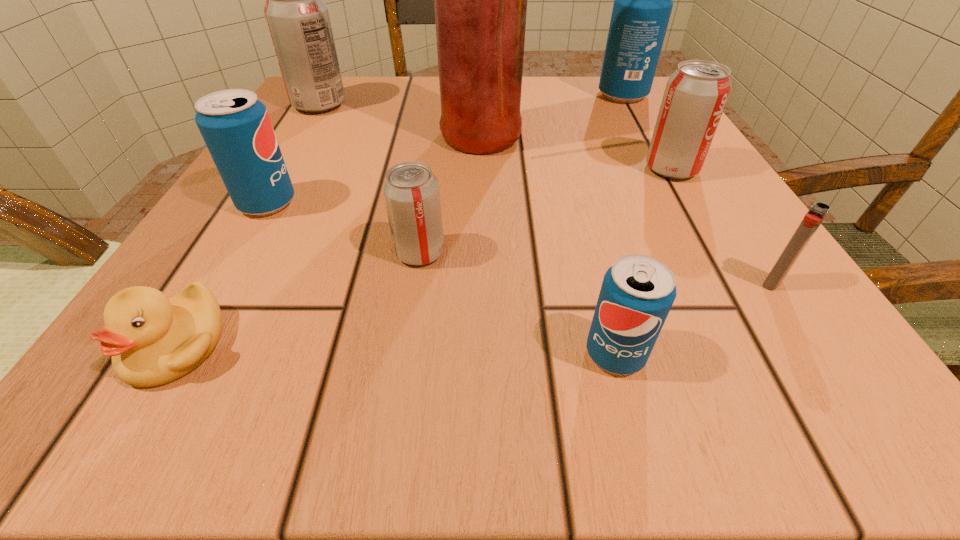
Identify the location of object situated at the far left corner. (298, 20).

Where is `object that is positioned at the near left corner`? Image resolution: width=960 pixels, height=540 pixels. object that is positioned at the near left corner is located at coordinates (153, 340).

Where is `object that is at the far right corner`? object that is at the far right corner is located at coordinates (643, 0).

This screenshot has height=540, width=960. I want to click on free region at the far edge of the desktop, so click(559, 80).

The width and height of the screenshot is (960, 540). In the image, there is a desktop. In order to click on free space at the near edge in this screenshot , I will do `click(660, 397)`.

This screenshot has width=960, height=540. In the image, there is a desktop. In order to click on vacant region at the left edge in this screenshot , I will do `click(346, 166)`.

Where is `vacant area at the right edge of the desktop`? The height and width of the screenshot is (540, 960). vacant area at the right edge of the desktop is located at coordinates (717, 257).

Locate an element on the screen. This screenshot has width=960, height=540. free region at the far left corner of the desktop is located at coordinates (293, 122).

You are a GUI agent. You are given a task and a screenshot of the screen. Output one action in this format:
    pyautogui.click(x=<x>, y=<y>)
    Task: Click on the vacant area at the far right corner
    The image size is (960, 540).
    Given the screenshot: What is the action you would take?
    pyautogui.click(x=581, y=87)

In the image, there is a desktop. Where is `free space at the near right corner`? Image resolution: width=960 pixels, height=540 pixels. free space at the near right corner is located at coordinates (697, 359).